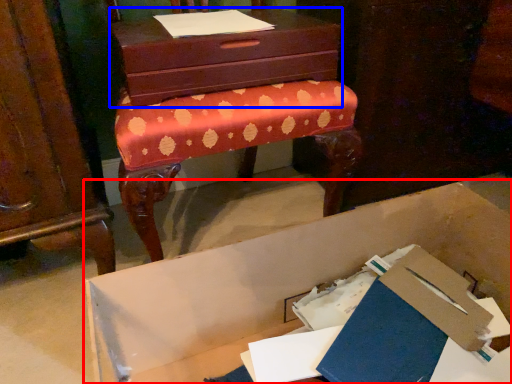
Question: Which object is closer to the camera taking this photo, cardboard box (highlighted by a red box) or chest of drawers (highlighted by a blue box)?

Choices:
 (A) cardboard box
 (B) chest of drawers

Answer: (A)